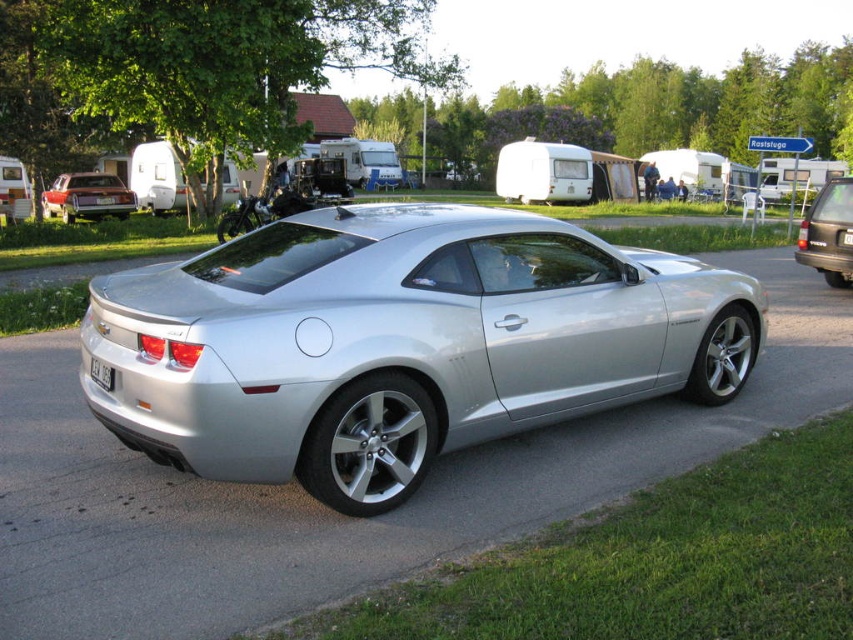
You are a delivery driver who needs to park your truck in this campground. The truck requires a parking spot that is 10 meters away from the silver metallic sports car at center. Can you park your truck in this location?

The silver metallic sports car at center is located at point (399, 342). Without knowing the exact dimensions of the parking area or the distance from this coordinate to potential parking spots, it is impossible to determine if the truck can be parked 10 meters away.

You are standing at the center of the campground and want to locate the satin black suv at right. According to the coordinates provided, where should you look relative to your position?

The satin black suv at right is located at coordinates point (828, 234), which means it is positioned to the lower right of your current position at the center of the campground.